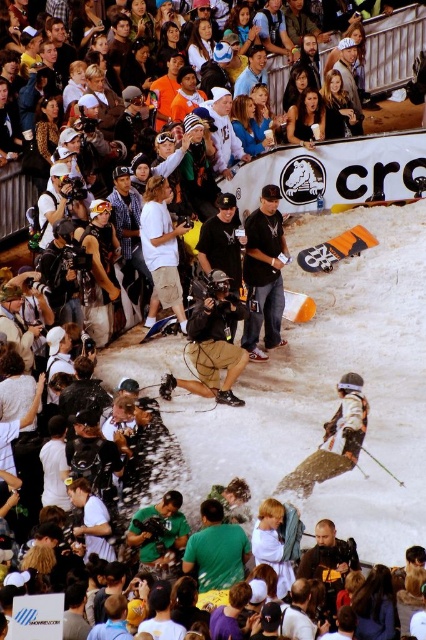
Question: Which point is farther to the camera?

Choices:
 (A) (249, 548)
 (B) (230, 195)
 (C) (215, 106)
 (D) (227, 378)

Answer: (C)

Question: Among these objects, which one is nearest to the camera?

Choices:
 (A) white cotton shirt at center
 (B) smooth skin face at upper center
 (C) black matte camera at center

Answer: (C)

Question: Can you confirm if white matte snowboard at center is wider than matte black jacket at upper center?

Choices:
 (A) yes
 (B) no

Answer: (A)

Question: Is black matte camera at center above white cotton shirt at center?

Choices:
 (A) yes
 (B) no

Answer: (B)

Question: Which object is the closest to the smooth skin face at upper center?

Choices:
 (A) black matte cap at center
 (B) green fabric shirt at center
 (C) black matte camera at center
 (D) black cotton shirt at center

Answer: (D)

Question: In this image, where is green matte shirt at center located relative to green fabric shirt at center?

Choices:
 (A) above
 (B) below

Answer: (B)